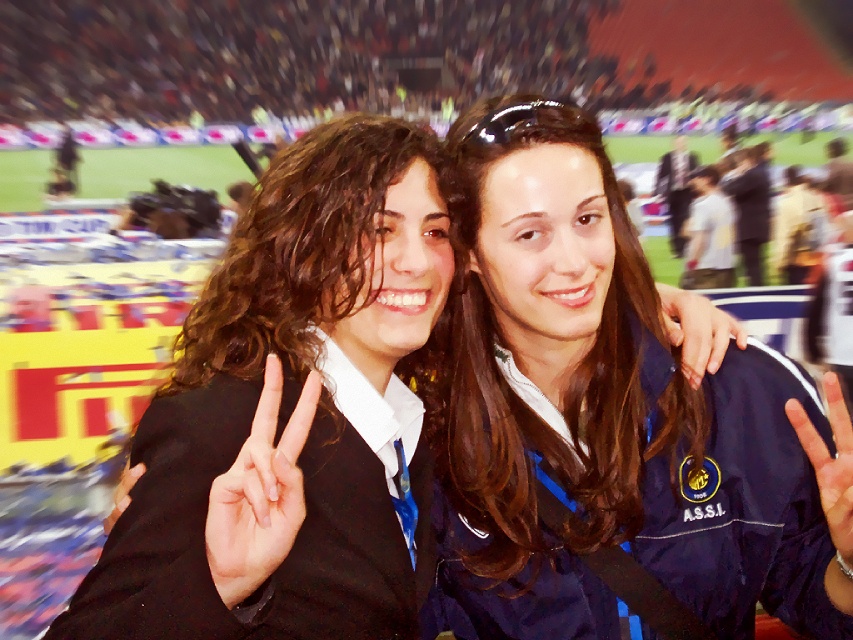
Question: Which of the following is the closest to the observer?

Choices:
 (A) light skin hand at center
 (B) black matte suit at center
 (C) matte black hand at center
 (D) white matte hand at center

Answer: (D)

Question: Estimate the real-world distances between objects in this image. Which object is closer to the light skin hand at center?

Choices:
 (A) black matte blazer at center
 (B) white matte hand at center

Answer: (B)

Question: From the image, what is the correct spatial relationship of blue fabric jacket at center in relation to black matte suit at center?

Choices:
 (A) above
 (B) below

Answer: (B)

Question: Observing the image, what is the correct spatial positioning of blue fabric jacket at center in reference to matte black hand at center?

Choices:
 (A) left
 (B) right

Answer: (B)

Question: Which point appears farthest from the camera in this image?

Choices:
 (A) (386, 161)
 (B) (686, 344)
 (C) (312, 563)

Answer: (B)

Question: Does black matte suit at center have a lesser width compared to light skin hand at center?

Choices:
 (A) yes
 (B) no

Answer: (B)